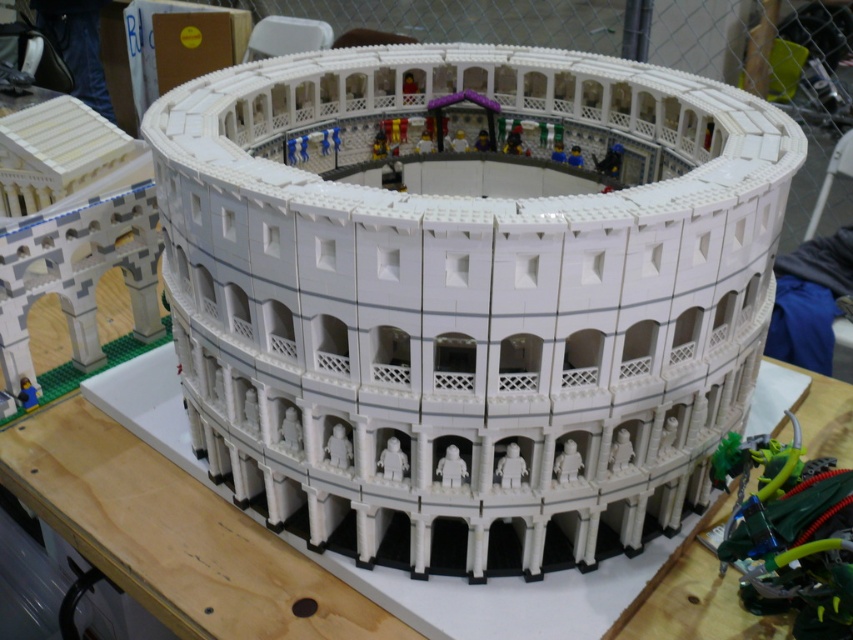
Question: Considering the relative positions of white lego colosseum at center and wooden table at center in the image provided, where is white lego colosseum at center located with respect to wooden table at center?

Choices:
 (A) left
 (B) right

Answer: (B)

Question: Does white lego colosseum at center have a lesser width compared to wooden table at center?

Choices:
 (A) yes
 (B) no

Answer: (A)

Question: Can you confirm if white lego colosseum at center is positioned above wooden table at center?

Choices:
 (A) no
 (B) yes

Answer: (B)

Question: Which of the following is the farthest from the observer?

Choices:
 (A) (76, 477)
 (B) (511, 390)

Answer: (A)

Question: Among these objects, which one is farthest from the camera?

Choices:
 (A) wooden table at center
 (B) white lego colosseum at center

Answer: (A)